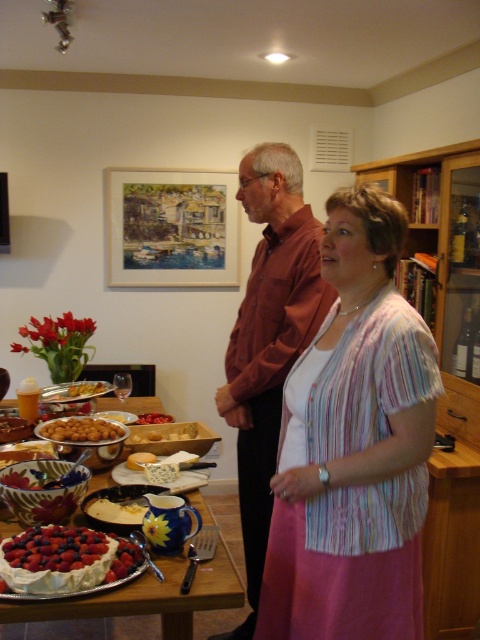
Question: Which is nearer to the striped fabric dress at center?

Choices:
 (A) brown cotton shirt at center
 (B) blue cheese at center
 (C) ruffled white cake at lower left
 (D) matte white cake at center

Answer: (D)

Question: Is ripe berries at center closer to camera compared to blue cheese at center?

Choices:
 (A) yes
 (B) no

Answer: (A)

Question: Which point is closer to the camera?

Choices:
 (A) brown cotton shirt at center
 (B) matte silver platter at center

Answer: (A)

Question: Which object is positioned closest to the ripe berries at center?

Choices:
 (A) matte white cake at center
 (B) brown cotton shirt at center
 (C) golden brown bread at center

Answer: (A)

Question: Can you confirm if matte silver platter at center is bigger than yellow cheese at center?

Choices:
 (A) yes
 (B) no

Answer: (A)

Question: Does matte white cake at center have a lesser width compared to yellow cheese at center?

Choices:
 (A) no
 (B) yes

Answer: (A)